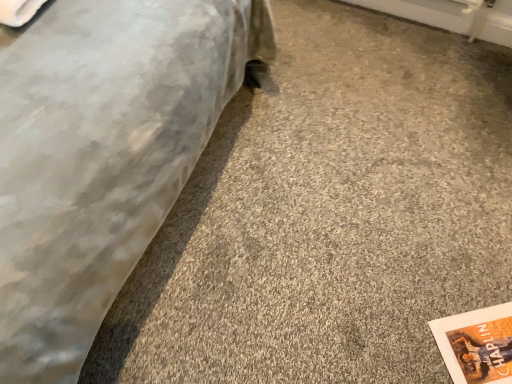
Locate an element on the screen. orange paper book at lower right is located at coordinates (477, 344).

Image resolution: width=512 pixels, height=384 pixels. Describe the element at coordinates (477, 344) in the screenshot. I see `orange paper book at lower right` at that location.

Where is `orange paper book at lower right`? This screenshot has width=512, height=384. orange paper book at lower right is located at coordinates (477, 344).